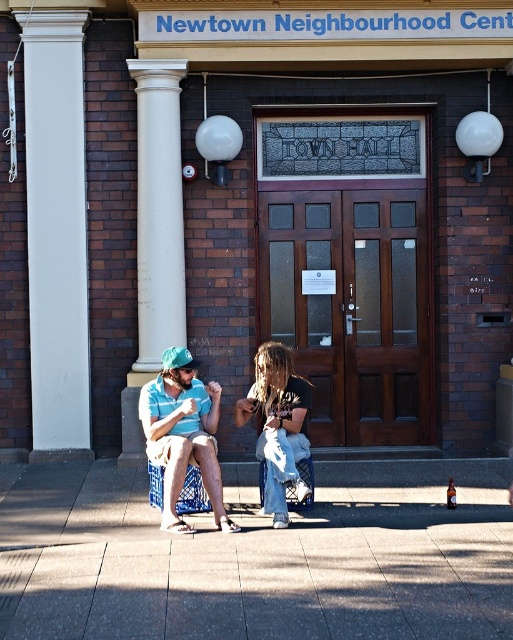
In the scene shown: Does white smooth column at left lie in front of denim pants at center?

No.

How distant is white smooth column at left from denim pants at center?

2.03 meters

Is point (125, 442) farther from camera compared to point (268, 358)?

Yes, point (125, 442) is behind point (268, 358).

Where is `white smooth column at left`? white smooth column at left is located at coordinates (155, 236).

Between point (107, 529) and point (146, 220), which one is positioned behind?

Positioned behind is point (146, 220).

How distant is gray concrete pavement at lower center from white smooth column at left?

A distance of 2.81 meters exists between gray concrete pavement at lower center and white smooth column at left.

Is point (396, 488) positioned after point (136, 180)?

No, (396, 488) is closer to viewer.

Find the location of a particular element. This screenshot has width=513, height=640. gray concrete pavement at lower center is located at coordinates (259, 557).

Consider the image. Can you confirm if matte blue shorts at center is thinner than denim pants at center?

No, matte blue shorts at center is not thinner than denim pants at center.

Does matte blue shorts at center have a greater width compared to denim pants at center?

Yes, matte blue shorts at center is wider than denim pants at center.

Is point (160, 458) behind point (280, 509)?

Yes, it is behind point (280, 509).

The width and height of the screenshot is (513, 640). What are the coordinates of `matte blue shorts at center` in the screenshot? It's located at (183, 435).